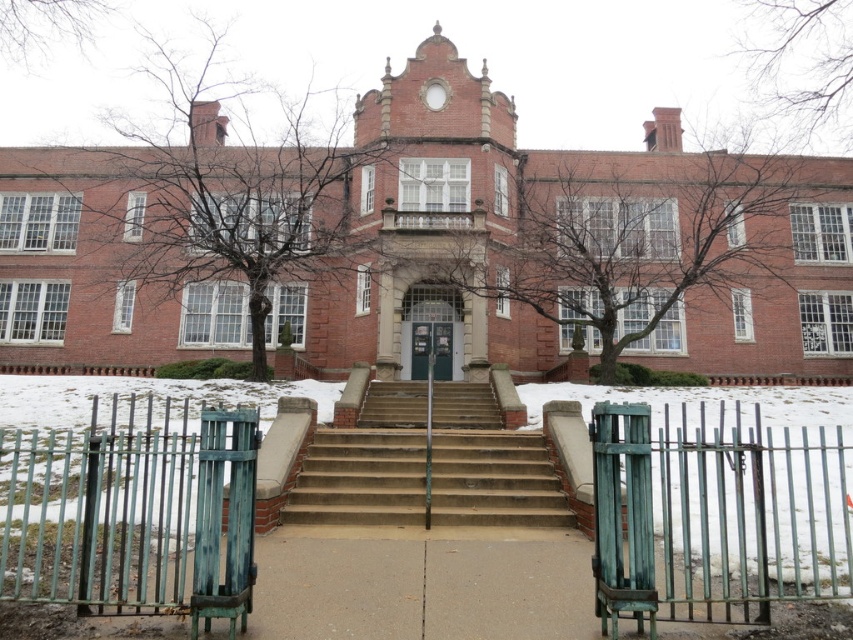
Question: Is green patina metal gate at lower left to the right of brown concrete stairs at center from the viewer's perspective?

Choices:
 (A) yes
 (B) no

Answer: (B)

Question: Does green patina metal gate at lower left appear under brown concrete stairs at center?

Choices:
 (A) no
 (B) yes

Answer: (A)

Question: Can you confirm if green patina metal gate at lower right is positioned below brown concrete stairs at center?

Choices:
 (A) yes
 (B) no

Answer: (B)

Question: Which point is farther to the camera?

Choices:
 (A) (302, 502)
 (B) (815, 540)

Answer: (A)

Question: Based on their relative distances, which object is nearer to the green patina metal gate at lower left?

Choices:
 (A) brown concrete stairs at center
 (B) green patina metal gate at lower right

Answer: (B)

Question: Which point is closer to the camera?

Choices:
 (A) brown concrete stairs at center
 (B) green patina metal gate at lower left

Answer: (B)